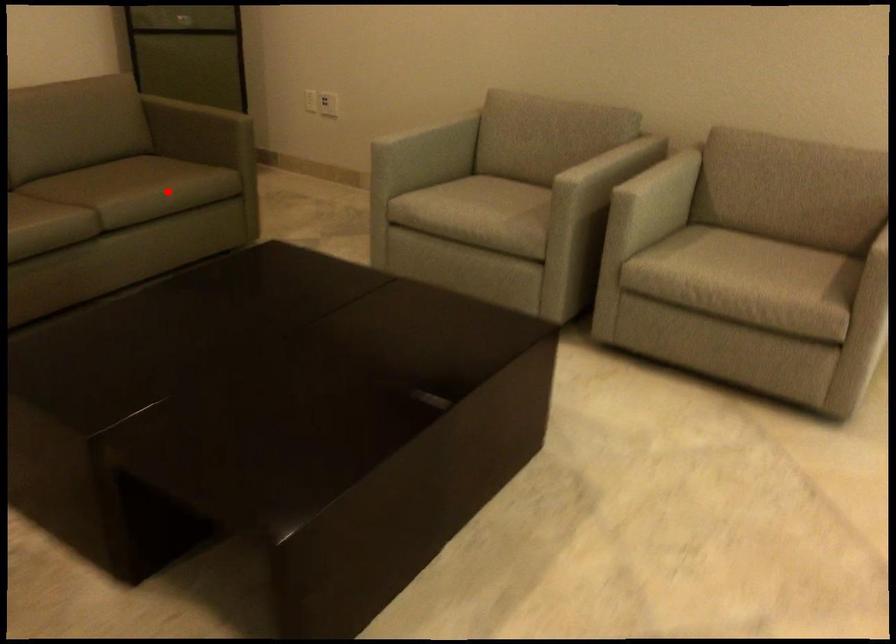
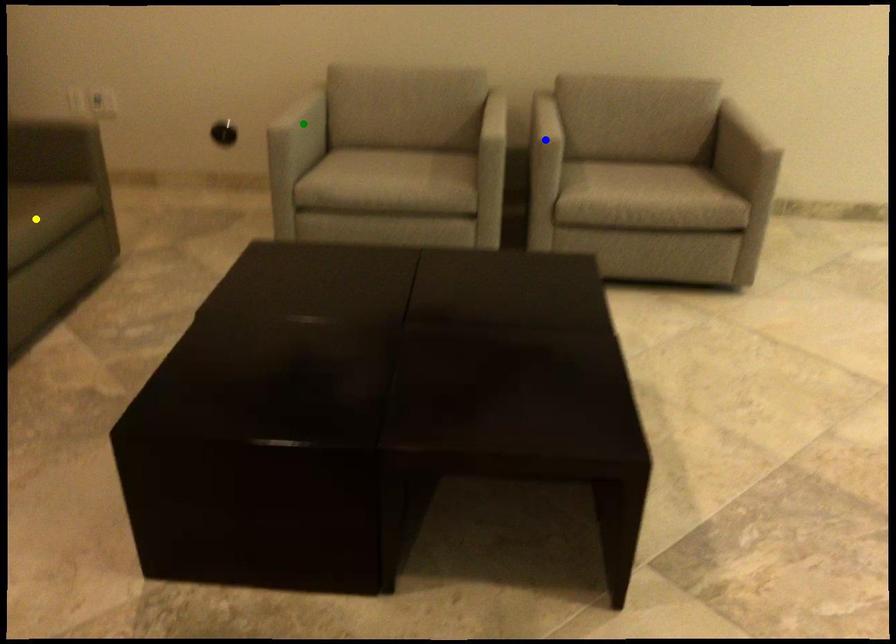
Question: I am providing you with two images of the same scene from different viewpoints. A red point is marked on the first image. You are given multiple points on the second image. Can you choose the point in image 2 that corresponds to the point in image 1?

Choices:
 (A) green point
 (B) yellow point
 (C) blue point

Answer: (B)